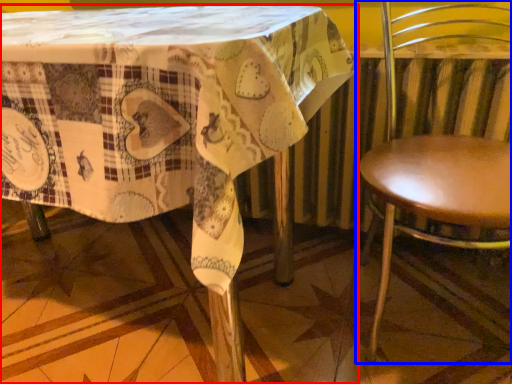
Question: Which point is further to the camera, table (highlighted by a red box) or chair (highlighted by a blue box)?

Choices:
 (A) table
 (B) chair

Answer: (B)